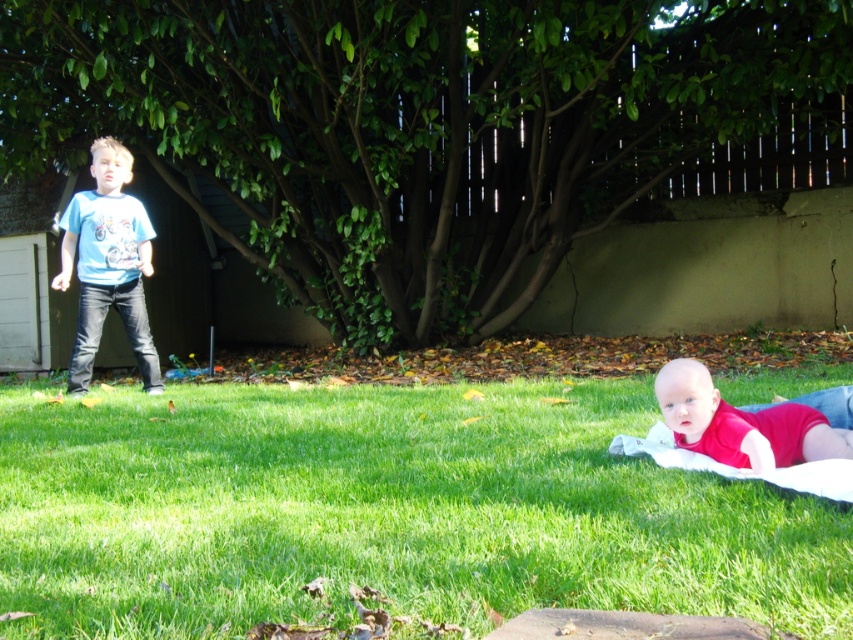
How far apart are green leafy tree at upper center and blue cotton shirt at left?

The distance of green leafy tree at upper center from blue cotton shirt at left is 19.14 feet.

Is point (552, 234) positioned in front of point (91, 346)?

No, it is not.

Between point (317, 8) and point (120, 317), which one is positioned behind?

The point (317, 8) is behind.

This screenshot has width=853, height=640. Identify the location of green leafy tree at upper center. (409, 125).

Who is positioned more to the right, green grass at lower center or red smooth baby at lower right?

red smooth baby at lower right

Is point (495, 451) closer to viewer compared to point (751, 449)?

No, (495, 451) is further to viewer.

You are a GUI agent. You are given a task and a screenshot of the screen. Output one action in this format:
    pyautogui.click(x=<x>, y=<y>)
    Task: Click on the green grass at lower center
    
    Given the screenshot: What is the action you would take?
    pyautogui.click(x=386, y=513)

This screenshot has height=640, width=853. I want to click on green grass at lower center, so click(386, 513).

Is blue cotton shirt at left thinner than red smooth baby at lower right?

Yes.

Which of these two, blue cotton shirt at left or red smooth baby at lower right, stands taller?

blue cotton shirt at left is taller.

Who is more distant from viewer, (132, 323) or (724, 460)?

Positioned behind is point (132, 323).

At what (x,y) coordinates should I click in order to perform the action: click on blue cotton shirt at left. Please return your answer as a coordinate pair (x, y). Looking at the image, I should click on (108, 264).